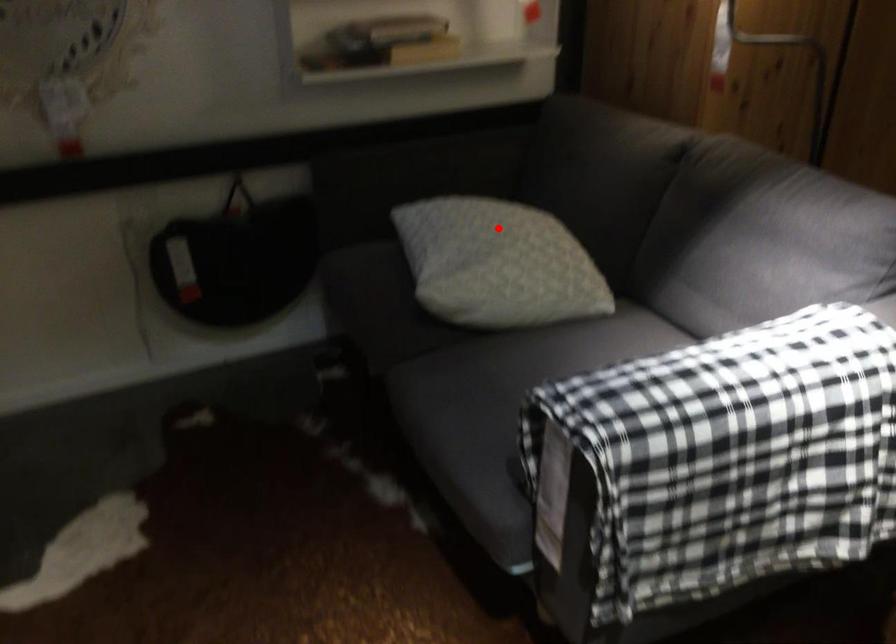
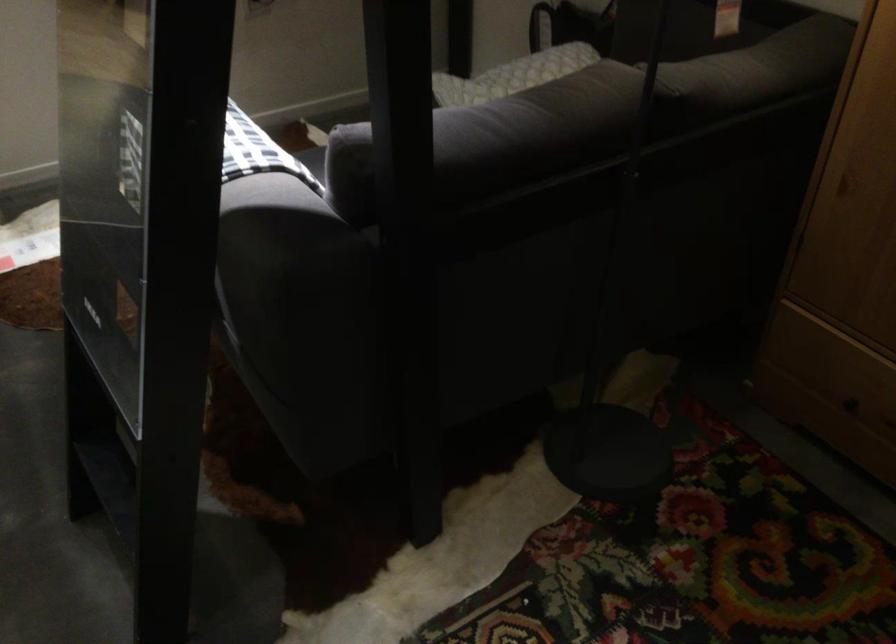
In the second image, find the point that corresponds to the highlighted location in the first image.

(528, 68)